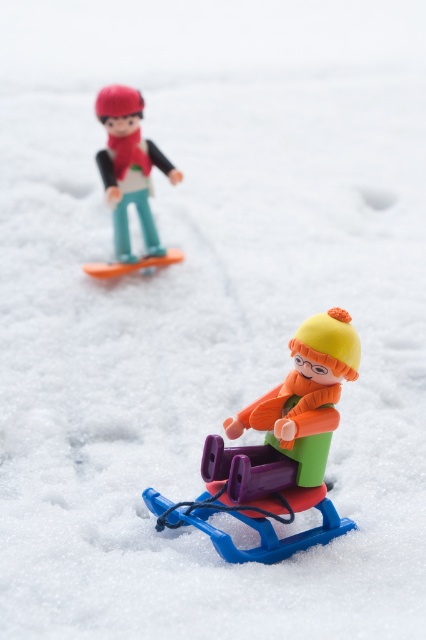
Which is above, matte plastic sled at lower center or matte plastic skier at upper left?

Positioned higher is matte plastic skier at upper left.

Which is below, matte plastic sled at lower center or matte plastic skier at upper left?

Positioned lower is matte plastic sled at lower center.

Image resolution: width=426 pixels, height=640 pixels. What are the coordinates of `matte plastic sled at lower center` in the screenshot? It's located at point(278,449).

The width and height of the screenshot is (426, 640). I want to click on matte plastic sled at lower center, so click(278, 449).